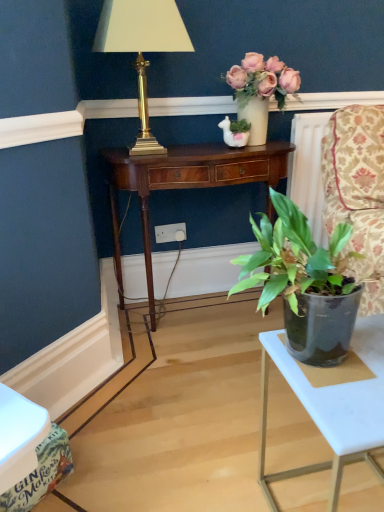
At what (x,y) coordinates should I click in order to perform the action: click on vacant area that lies in front of mahogany wood desk at center. Please return your answer as a coordinate pair (x, y). Looking at the image, I should click on (190, 386).